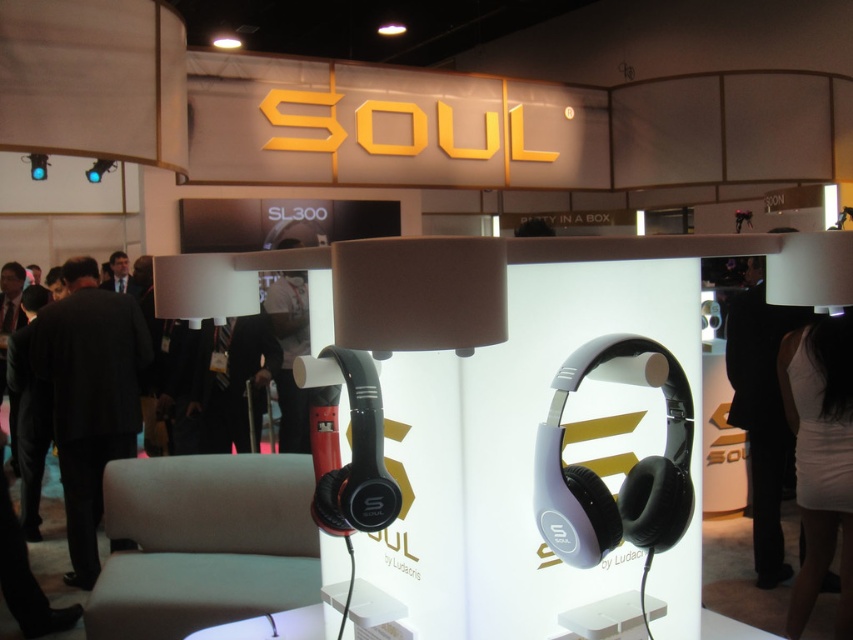
You are a visitor at the exhibition and want to sit down while checking the headphones. The light gray fabric stool at lower left and the white fabric bag at center are both in your view. Which one can you sit on?

The light gray fabric stool at lower left has a smaller size compared to the white fabric bag at center, so the white fabric bag at center is larger and more suitable for sitting on.

You are standing at the entrance of the trade show booth and want to sit down to try the headphones. The booth has a light gray fabric stool at lower left. Can you reach the stool without moving past the display stand for the headphones?

The light gray fabric stool at lower left is 7.80 feet away from viewer. Since the distance is not specified between the display stand and the stool, it is unclear if you can reach it without moving past the display stand for the headphones.

You are a photographer setting up for a product shoot at the SOUL booth. You need to position a tripod between the light gray fabric stool at lower left and the white matte dress at lower right. Since the tripod requires a flat surface, will the stool or the dress provide a more stable base?

The light gray fabric stool at lower left has a lesser height compared to the white matte dress at lower right, so the stool is shorter and likely has a wider base, making it a more stable surface for the tripod.